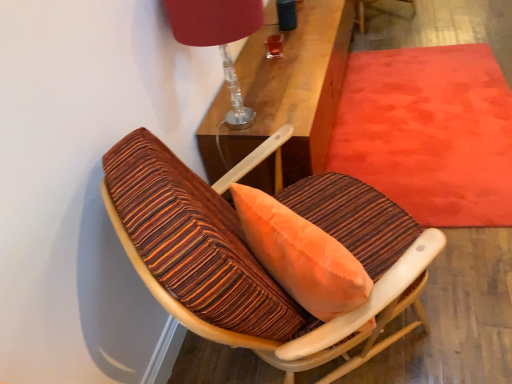
Question: From the image's perspective, is velvet red mat at upper right located above or below matte red lampshade at upper center?

Choices:
 (A) below
 (B) above

Answer: (A)

Question: Is point (426, 150) positioned closer to the camera than point (205, 11)?

Choices:
 (A) farther
 (B) closer

Answer: (A)

Question: Estimate the real-world distances between objects in this image. Which object is closer to the wooden textured chair at center?

Choices:
 (A) velvet red mat at upper right
 (B) matte red lampshade at upper center

Answer: (B)

Question: Which of these objects is positioned closest to the velvet red mat at upper right?

Choices:
 (A) wooden textured chair at center
 (B) matte red lampshade at upper center

Answer: (A)